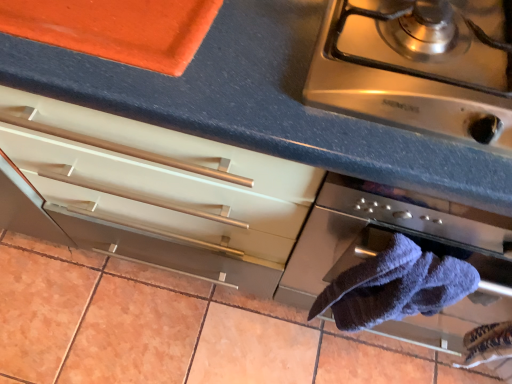
What do you see at coordinates (395, 286) in the screenshot? The image size is (512, 384). I see `dark blue textured towel at lower right` at bounding box center [395, 286].

Identify the location of dark blue textured towel at lower right. (395, 286).

Identify the location of dark blue textured towel at lower right. The image size is (512, 384). (395, 286).